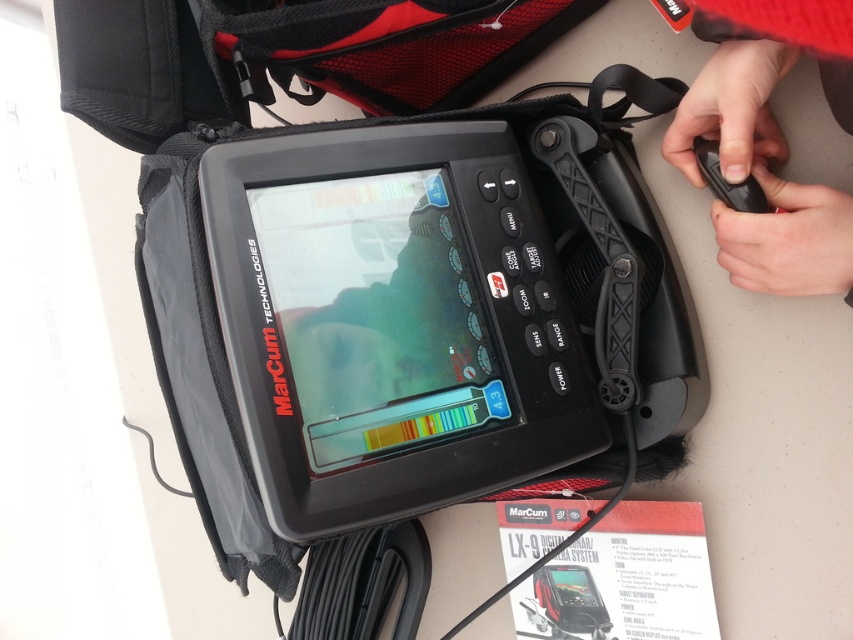
Which is more to the right, black matte remote control at upper right or black rubber remote control at upper right?

From the viewer's perspective, black matte remote control at upper right appears more on the right side.

Is point (744, 236) closer to viewer compared to point (766, 204)?

Yes, point (744, 236) is in front of point (766, 204).

Locate an element on the screen. This screenshot has width=853, height=640. black matte remote control at upper right is located at coordinates (761, 177).